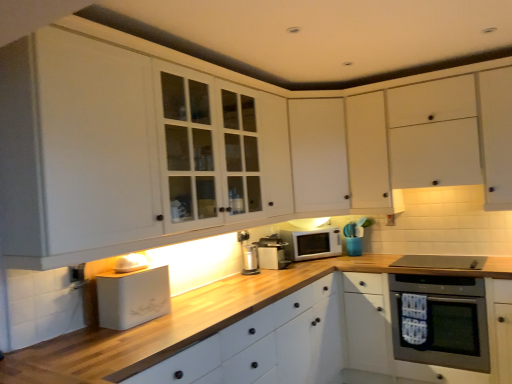
Question: Which direction should I rotate to face satin silver toaster at center, which is the third appliance from front to back, — up or down?

Choices:
 (A) down
 (B) up

Answer: (A)

Question: Can you confirm if white matte cabinet at upper center, the third cabinetry in the front-to-back sequence, is positioned to the right of white matte cabinet at center, the third cabinetry when ordered from back to front?

Choices:
 (A) no
 (B) yes

Answer: (B)

Question: From the image's perspective, is white matte cabinet at upper center, the 1th cabinetry viewed from the back, on top of white matte cabinet at center, the third cabinetry when ordered from back to front?

Choices:
 (A) no
 (B) yes

Answer: (B)

Question: Are white matte cabinet at upper center, the third cabinetry in the front-to-back sequence, and white matte cabinet at center, the third cabinetry when ordered from back to front, far apart?

Choices:
 (A) no
 (B) yes

Answer: (A)

Question: Considering the relative positions of white matte cabinet at upper center, the 1th cabinetry viewed from the back, and white matte cabinet at center, the 1th cabinetry in the front-to-back sequence, in the image provided, is white matte cabinet at upper center, the 1th cabinetry viewed from the back, in front of white matte cabinet at center, the 1th cabinetry in the front-to-back sequence,?

Choices:
 (A) yes
 (B) no

Answer: (B)

Question: From a real-world perspective, is white matte cabinet at upper center, the 1th cabinetry viewed from the back, under white matte cabinet at center, the 1th cabinetry in the front-to-back sequence?

Choices:
 (A) yes
 (B) no

Answer: (B)

Question: Is white matte cabinet at upper center, the third cabinetry in the front-to-back sequence, bigger than white matte cabinet at center, the 1th cabinetry in the front-to-back sequence?

Choices:
 (A) yes
 (B) no

Answer: (B)

Question: Considering the relative positions of white matte bread bin at lower left, arranged as the 1th appliance when viewed from the front, and white glossy microwave at center in the image provided, is white matte bread bin at lower left, arranged as the 1th appliance when viewed from the front, behind white glossy microwave at center?

Choices:
 (A) no
 (B) yes

Answer: (A)

Question: Does white matte bread bin at lower left, the third appliance viewed from the back, contain white glossy microwave at center?

Choices:
 (A) no
 (B) yes

Answer: (A)

Question: Can you confirm if white matte bread bin at lower left, the third appliance from the right, is bigger than white glossy microwave at center?

Choices:
 (A) yes
 (B) no

Answer: (B)

Question: From the image's perspective, is white matte bread bin at lower left, the third appliance from the right, on white glossy microwave at center?

Choices:
 (A) no
 (B) yes

Answer: (A)

Question: Considering the relative positions of white matte bread bin at lower left, the third appliance from the right, and white glossy microwave at center in the image provided, is white matte bread bin at lower left, the third appliance from the right, to the right of white glossy microwave at center from the viewer's perspective?

Choices:
 (A) yes
 (B) no

Answer: (B)

Question: Considering the relative sizes of white matte bread bin at lower left, the third appliance from the right, and white glossy microwave at center in the image provided, is white matte bread bin at lower left, the third appliance from the right, wider than white glossy microwave at center?

Choices:
 (A) yes
 (B) no

Answer: (A)

Question: Is satin silver toaster at center, the first appliance in the right-to-left sequence, not within white glossy microwave at center?

Choices:
 (A) yes
 (B) no

Answer: (A)